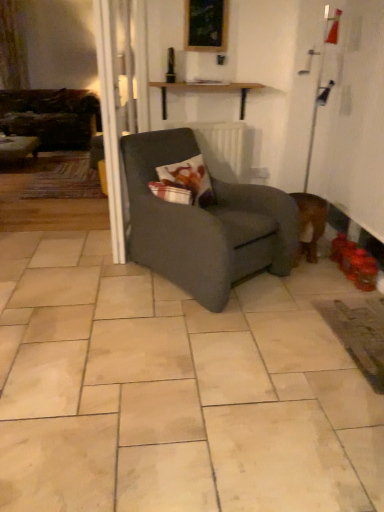
Where is `free space in front of white glossy screen door at left`? free space in front of white glossy screen door at left is located at coordinates (91, 272).